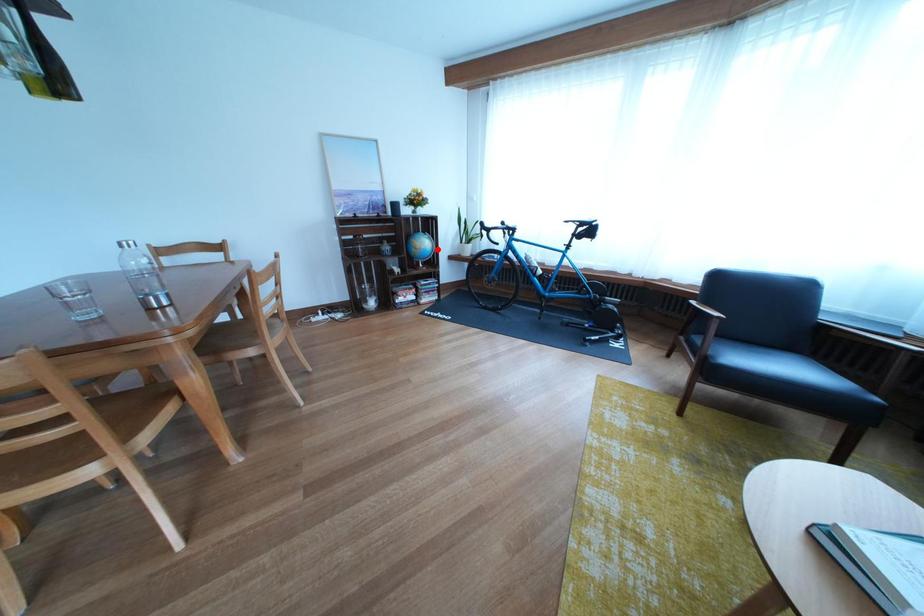
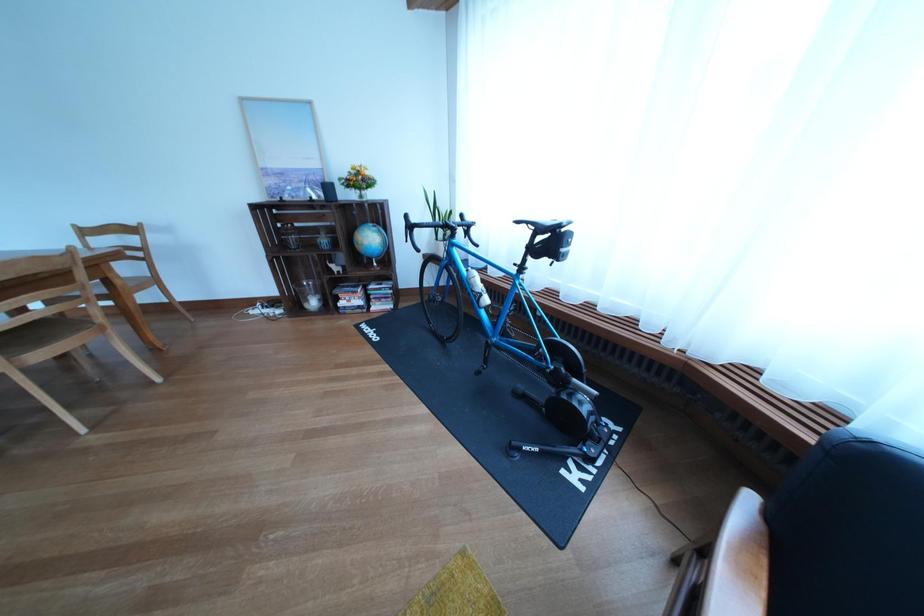
Question: A red point is marked in image1. In image2, is the corresponding 3D point closer to the camera or farther? Reply with the corresponding letter.

Choices:
 (A) The corresponding 3D point is closer.
 (B) The corresponding 3D point is farther.

Answer: (B)